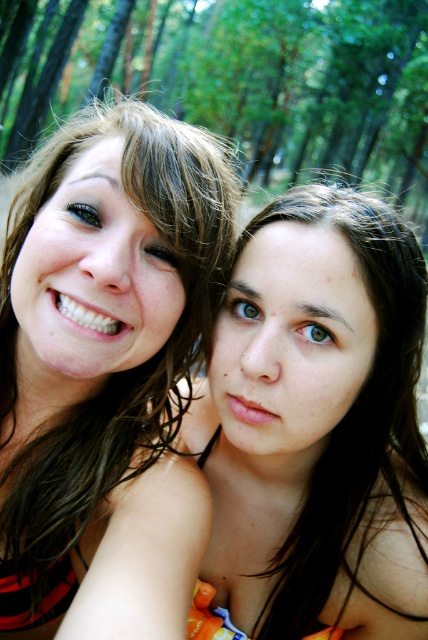
Looking at this image, who is higher up, matte black bikini top at left or green leafy trees at upper center?

green leafy trees at upper center is above.

Can you confirm if matte black bikini top at left is thinner than green leafy trees at upper center?

Yes.

Which is in front, point (2, 500) or point (253, 125)?

Positioned in front is point (2, 500).

At what (x,y) coordinates should I click in order to perform the action: click on matte black bikini top at left. Please return your answer as a coordinate pair (x, y). This screenshot has height=640, width=428. Looking at the image, I should click on (106, 372).